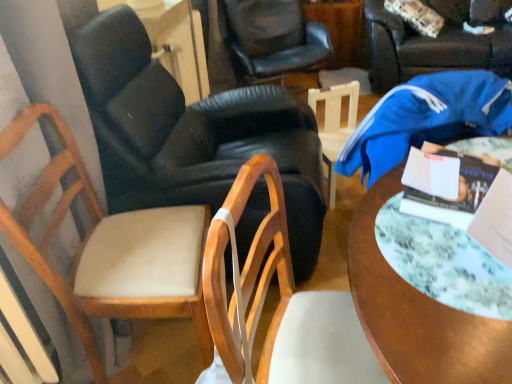
Question: Does light brown wood chair at left, which ranks as the 1th chair in left-to-right order, have a larger size compared to hardcover book at center right?

Choices:
 (A) no
 (B) yes

Answer: (B)

Question: From the image's perspective, would you say light brown wood chair at left, which ranks as the 1th chair in left-to-right order, is positioned over hardcover book at center right?

Choices:
 (A) no
 (B) yes

Answer: (A)

Question: From the image's perspective, is light brown wood chair at left, which ranks as the 1th chair in left-to-right order, beneath hardcover book at center right?

Choices:
 (A) yes
 (B) no

Answer: (A)

Question: Does light brown wood chair at left, which ranks as the 1th chair in left-to-right order, turn towards hardcover book at center right?

Choices:
 (A) no
 (B) yes

Answer: (B)

Question: Would you say light brown wood chair at left, which is counted as the sixth chair, starting from the right, is outside hardcover book at center right?

Choices:
 (A) no
 (B) yes

Answer: (B)

Question: In terms of height, does blue fabric chair at center, the 1th chair positioned from the right, look taller or shorter compared to leather armchair at center, the fifth chair viewed from the right?

Choices:
 (A) tall
 (B) short

Answer: (B)

Question: Visually, is blue fabric chair at center, the 1th chair positioned from the right, positioned to the left or to the right of leather armchair at center, the fifth chair viewed from the right?

Choices:
 (A) left
 (B) right

Answer: (B)

Question: From the image's perspective, is blue fabric chair at center, the 1th chair positioned from the right, located above or below leather armchair at center, the fifth chair viewed from the right?

Choices:
 (A) above
 (B) below

Answer: (A)

Question: From a real-world perspective, is blue fabric chair at center, the 6th chair positioned from the left, positioned above or below leather armchair at center, which appears as the second chair when viewed from the left?

Choices:
 (A) below
 (B) above

Answer: (A)

Question: Is wooden round table at center bigger or smaller than wooden chair at center, the 3th chair from the right?

Choices:
 (A) small
 (B) big

Answer: (B)

Question: Is wooden round table at center situated inside wooden chair at center, which ranks as the 4th chair in left-to-right order, or outside?

Choices:
 (A) outside
 (B) inside

Answer: (A)

Question: Is point (411, 347) positioned closer to the camera than point (274, 173)?

Choices:
 (A) closer
 (B) farther

Answer: (A)

Question: Considering the positions of wooden round table at center and wooden chair at center, which ranks as the 4th chair in left-to-right order, in the image, is wooden round table at center wider or thinner than wooden chair at center, which ranks as the 4th chair in left-to-right order,?

Choices:
 (A) wide
 (B) thin

Answer: (A)

Question: In the image, is hardcover book at center right positioned in front of or behind black leather chair at center, the fourth chair from the right?

Choices:
 (A) front
 (B) behind

Answer: (A)

Question: Considering the positions of hardcover book at center right and black leather chair at center, placed as the third chair when sorted from left to right, in the image, is hardcover book at center right bigger or smaller than black leather chair at center, placed as the third chair when sorted from left to right,?

Choices:
 (A) big
 (B) small

Answer: (B)